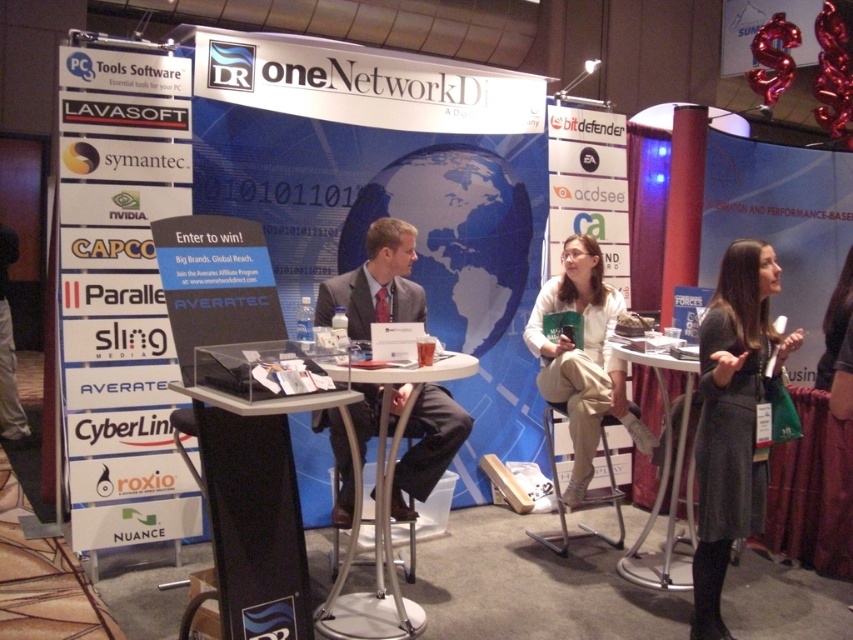
Which is below, matte black suit at center or white plastic table at center?

Positioned lower is white plastic table at center.

Is point (421, 312) more distant than point (341, 579)?

That is True.

Locate an element on the screen. matte black suit at center is located at coordinates (375, 282).

Consider the image. Can you confirm if white plastic table at center is wider than metallic silver table at center?

Indeed, white plastic table at center has a greater width compared to metallic silver table at center.

Is point (380, 600) more distant than point (698, 371)?

Yes, point (380, 600) is behind point (698, 371).

Does point (380, 481) lie behind point (648, 557)?

No, it is not.

The width and height of the screenshot is (853, 640). Identify the location of white plastic table at center. (381, 513).

Which is below, matte black suit at center or white fabric shirt at center?

Positioned lower is white fabric shirt at center.

Is matte black suit at center wider than white fabric shirt at center?

Yes, matte black suit at center is wider than white fabric shirt at center.

Who is more forward, (376, 285) or (527, 340)?

Point (376, 285) is in front.

Where is `matte black suit at center`? matte black suit at center is located at coordinates (375, 282).